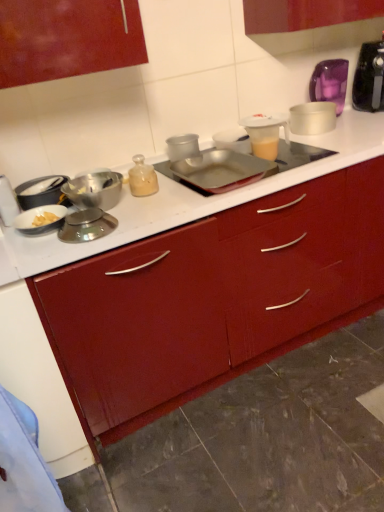
Image resolution: width=384 pixels, height=512 pixels. I want to click on vacant region in front of white plastic container at upper right, which ranks as the 7th kitchen appliance in left-to-right order, so click(x=323, y=142).